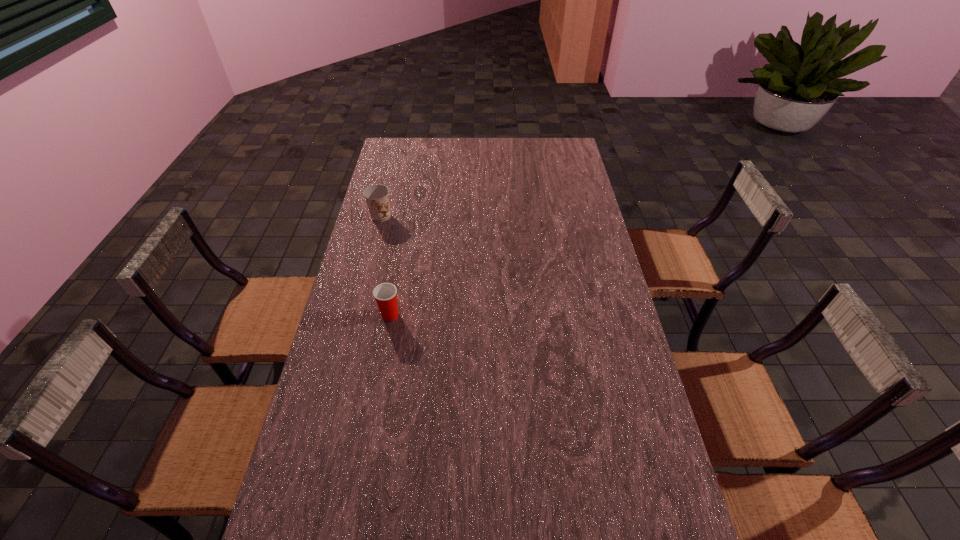
At what (x,y) coordinates should I click in order to perform the action: click on object at the far edge. Please return your answer as a coordinate pair (x, y). The width and height of the screenshot is (960, 540). Looking at the image, I should click on (467, 160).

At what (x,y) coordinates should I click in order to perform the action: click on object at the left edge. Please return your answer as a coordinate pair (x, y). Looking at the image, I should click on (413, 251).

You are a GUI agent. You are given a task and a screenshot of the screen. Output one action in this format:
    pyautogui.click(x=<x>, y=<y>)
    Task: Click on the dumbbell that is at the right edge
    The image size is (960, 540).
    Given the screenshot: What is the action you would take?
    pyautogui.click(x=630, y=481)

The width and height of the screenshot is (960, 540). In order to click on vacant space at the far edge in this screenshot , I will do `click(426, 159)`.

The image size is (960, 540). I want to click on vacant position at the left edge of the desktop, so click(x=348, y=339).

Locate an element on the screen. Image resolution: width=960 pixels, height=540 pixels. empty space that is in between the rightmost blue detergent and the left white detergent is located at coordinates (554, 300).

This screenshot has height=540, width=960. Find the location of `vacant space that's between the gray dumbbell and the nearest blue detergent`. vacant space that's between the gray dumbbell and the nearest blue detergent is located at coordinates (603, 423).

The width and height of the screenshot is (960, 540). Identify the location of unoccupied position between the second blue detergent from right to left and the smaller white detergent. (519, 219).

Identify the location of free space between the leftmost blue detergent and the smaller white detergent. (492, 262).

Where is `free space between the second nearest object and the smaller white detergent`? The width and height of the screenshot is (960, 540). free space between the second nearest object and the smaller white detergent is located at coordinates (584, 369).